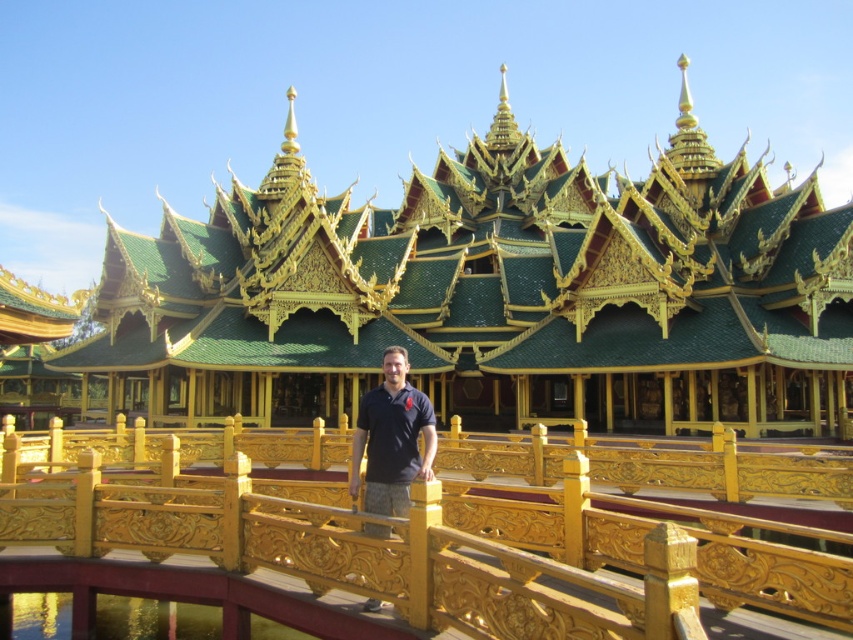
Does green glazed tile palace at center have a lesser width compared to dark blue polo shirt at center?

Incorrect, green glazed tile palace at center's width is not less than dark blue polo shirt at center's.

Does green glazed tile palace at center appear on the left side of dark blue polo shirt at center?

Yes, green glazed tile palace at center is to the left of dark blue polo shirt at center.

Who is more distant from viewer, (125, 388) or (387, 454)?

Positioned behind is point (125, 388).

The image size is (853, 640). Find the location of `green glazed tile palace at center`. green glazed tile palace at center is located at coordinates (489, 296).

Can you confirm if green glazed tile palace at center is positioned below gold polished wood rail at center?

No.

Is green glazed tile palace at center shorter than gold polished wood rail at center?

Incorrect, green glazed tile palace at center's height does not fall short of gold polished wood rail at center's.

You are a GUI agent. You are given a task and a screenshot of the screen. Output one action in this format:
    pyautogui.click(x=<x>, y=<y>)
    Task: Click on the green glazed tile palace at center
    
    Given the screenshot: What is the action you would take?
    pyautogui.click(x=489, y=296)

In order to click on green glazed tile palace at center in this screenshot , I will do `click(489, 296)`.

Which is below, gold polished wood rail at center or dark blue polo shirt at center?

Positioned lower is gold polished wood rail at center.

Can you confirm if gold polished wood rail at center is smaller than dark blue polo shirt at center?

No, gold polished wood rail at center is not smaller than dark blue polo shirt at center.

Does point (22, 481) lie in front of point (363, 442)?

No, (22, 481) is further to viewer.

Find the location of `gold polished wood rail at center`. gold polished wood rail at center is located at coordinates (421, 531).